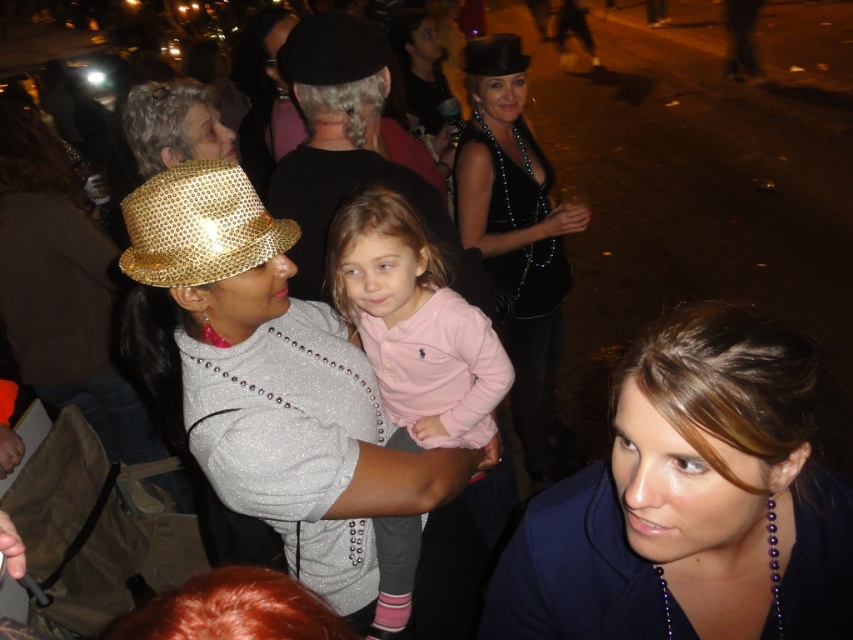
Is blue fabric at center wider than shiny black hat at upper center?

Yes, blue fabric at center is wider than shiny black hat at upper center.

Between blue fabric at center and shiny black hat at upper center, which one has more height?

Standing taller between the two is blue fabric at center.

Between point (704, 364) and point (473, 61), which one is positioned behind?

The point (473, 61) is behind.

Where is `blue fabric at center`? This screenshot has width=853, height=640. blue fabric at center is located at coordinates (689, 500).

Is point (790, 364) farther from viewer compared to point (492, 246)?

No, it is not.

Does blue fabric at center appear over shiny black dress at center?

No.

At what (x,y) coordinates should I click in order to perform the action: click on blue fabric at center. Please return your answer as a coordinate pair (x, y). Looking at the image, I should click on (689, 500).

In the scene shown: Can you confirm if sparkly gold hat at center is thinner than shiny black dress at center?

Incorrect, sparkly gold hat at center's width is not less than shiny black dress at center's.

Can you confirm if sparkly gold hat at center is wider than shiny black dress at center?

Yes, sparkly gold hat at center is wider than shiny black dress at center.

Is point (254, 232) behind point (514, 381)?

No, it is in front of (514, 381).

The width and height of the screenshot is (853, 640). I want to click on sparkly gold hat at center, so [x=283, y=400].